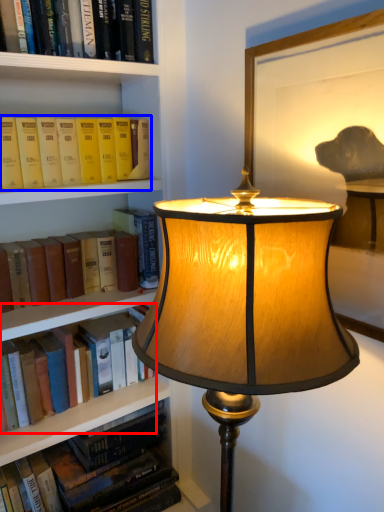
Question: Among these objects, which one is farthest to the camera, book (highlighted by a red box) or book (highlighted by a blue box)?

Choices:
 (A) book
 (B) book

Answer: (A)